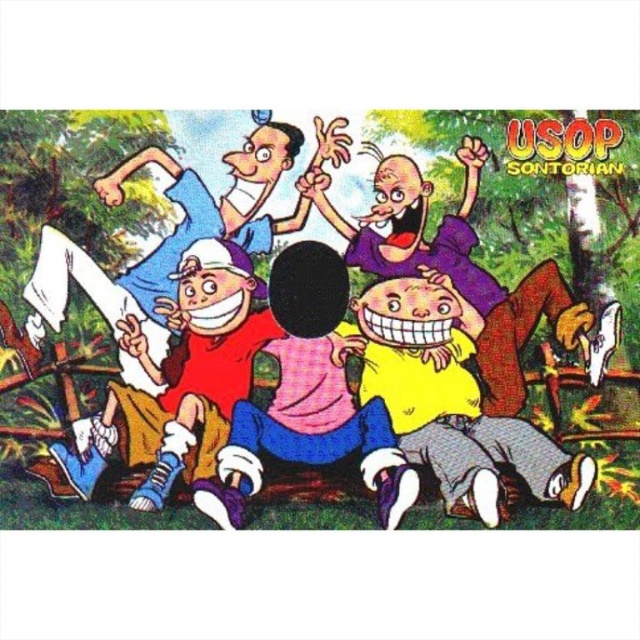
Question: Can you confirm if smooth plastic head at center is positioned below matte pink shirt at center?

Choices:
 (A) yes
 (B) no

Answer: (B)

Question: Which is nearer to the matte pink shirt at center?

Choices:
 (A) yellow matte shirt at center
 (B) smooth purple shirt at center
 (C) smooth plastic head at center

Answer: (C)

Question: Is matte red shirt at center below matte pink shirt at center?

Choices:
 (A) no
 (B) yes

Answer: (A)

Question: Which object is farther from the camera taking this photo?

Choices:
 (A) matte pink shirt at center
 (B) matte red shirt at center
 (C) yellow matte shirt at center
 (D) smooth plastic head at center

Answer: (A)

Question: In this image, where is smooth plastic head at center located relative to matte red shirt at center?

Choices:
 (A) above
 (B) below

Answer: (A)

Question: Which object is farther from the camera taking this photo?

Choices:
 (A) smooth plastic head at center
 (B) smooth purple shirt at center
 (C) matte pink shirt at center
 (D) matte red shirt at center

Answer: (B)